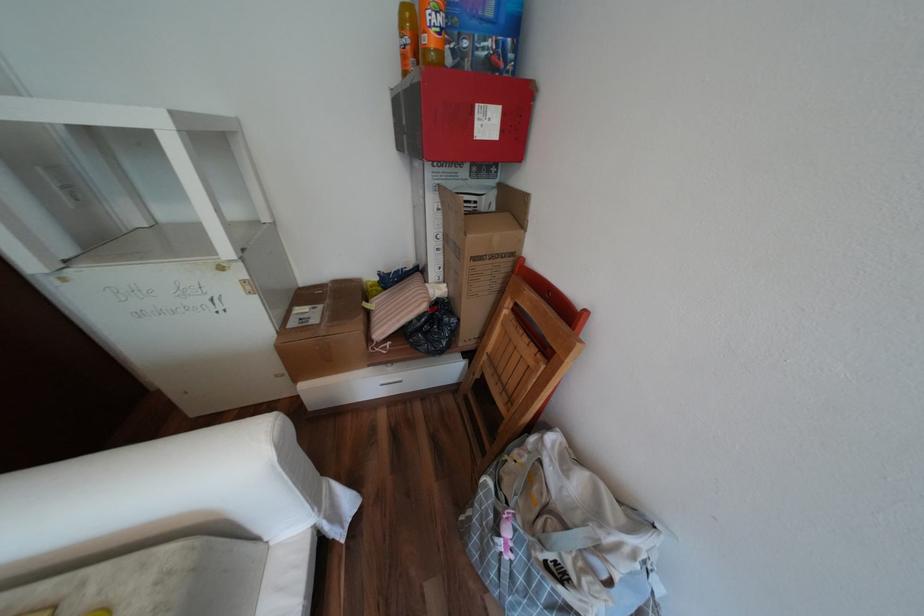
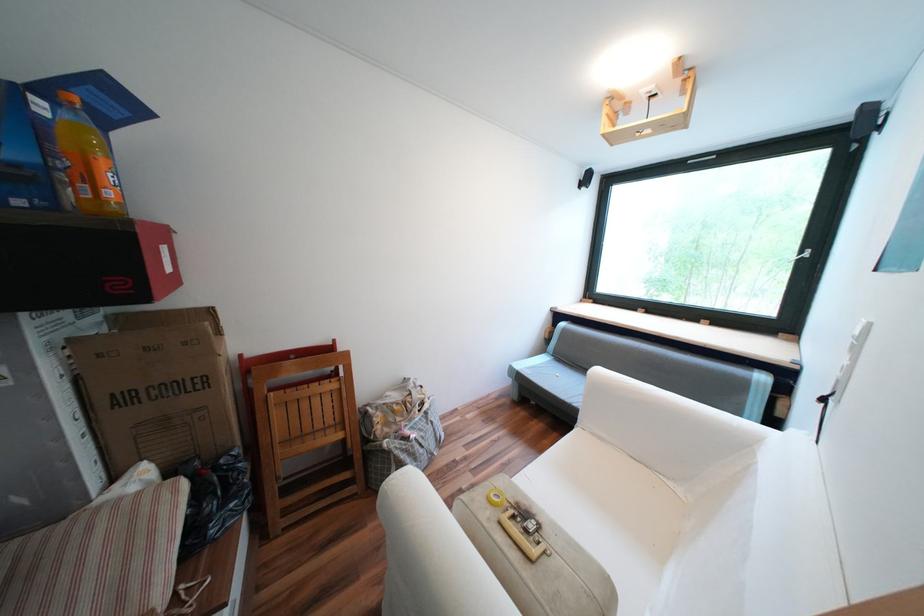
Locate, in the second image, the point that corresponds to pixel 537 339 in the first image.

(325, 383)